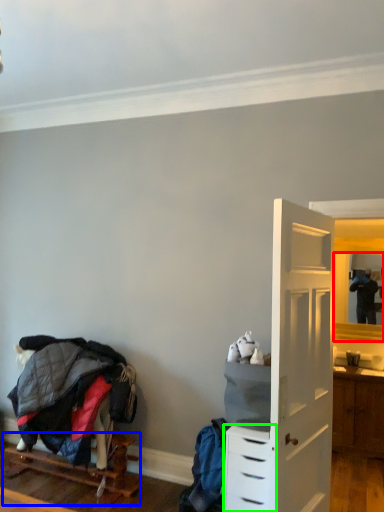
Question: Which object is the closest to the mirror (highlighted by a red box)? Choose among these: furniture (highlighted by a blue box) or chest of drawers (highlighted by a green box).

Choices:
 (A) furniture
 (B) chest of drawers

Answer: (B)